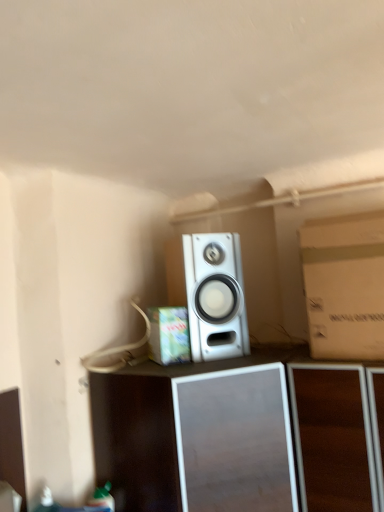
Question: Considering their positions, is brown cardboard box at right, the first cardboard box from the right, located in front of or behind silver metallic speaker at center?

Choices:
 (A) front
 (B) behind

Answer: (B)

Question: From their relative heights in the image, would you say brown cardboard box at right, arranged as the 2th cardboard box when viewed from the left, is taller or shorter than silver metallic speaker at center?

Choices:
 (A) tall
 (B) short

Answer: (B)

Question: Which is farther from the silver metallic speaker at center?

Choices:
 (A) cardboard box at center, the first cardboard box viewed from the left
 (B) brown cardboard box at right, the first cardboard box from the right
 (C) silver metallic speaker at center

Answer: (B)

Question: Which of these objects is positioned closest to the silver metallic speaker at center?

Choices:
 (A) silver metallic speaker at center
 (B) brown cardboard box at right, arranged as the 2th cardboard box when viewed from the left
 (C) cardboard box at center, placed as the second cardboard box when sorted from right to left

Answer: (C)